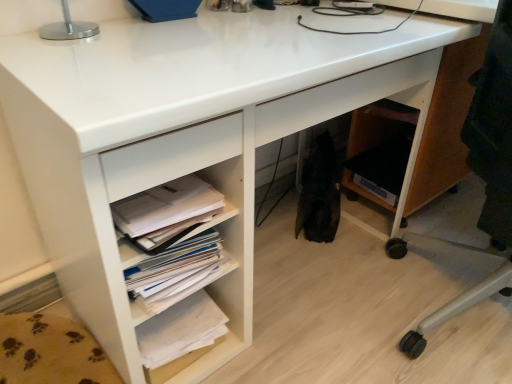
Identify the location of vacant area on top of white paper at lower left (from a real-world perspective). (162, 200).